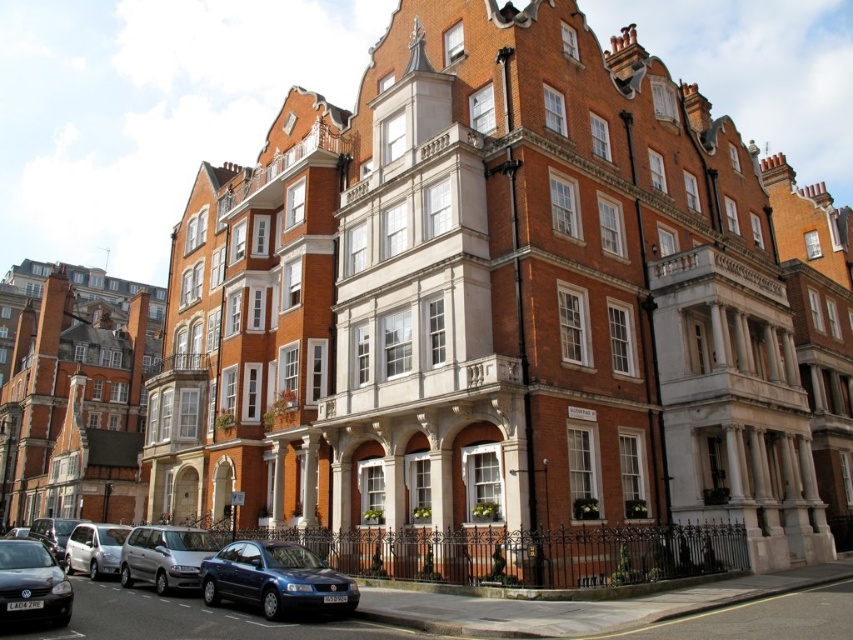
You are a delivery driver who needs to park your matte blue sedan at lower left closer to the camera. Can you move it forward to be within 30 meters of the camera without moving other vehicles?

The matte blue sedan at lower left is currently 36.75 meters away from the camera. To park it within 30 meters, you would need to move it forward by approximately 6.75 meters. However, since there are no other vehicles mentioned in the scene, you can safely move the matte blue sedan at lower left forward to achieve the desired distance.